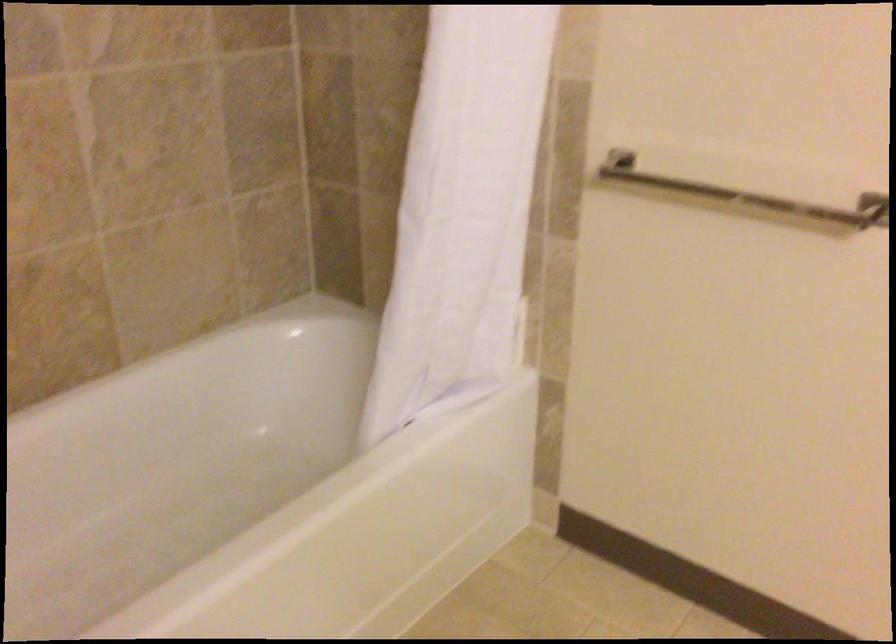
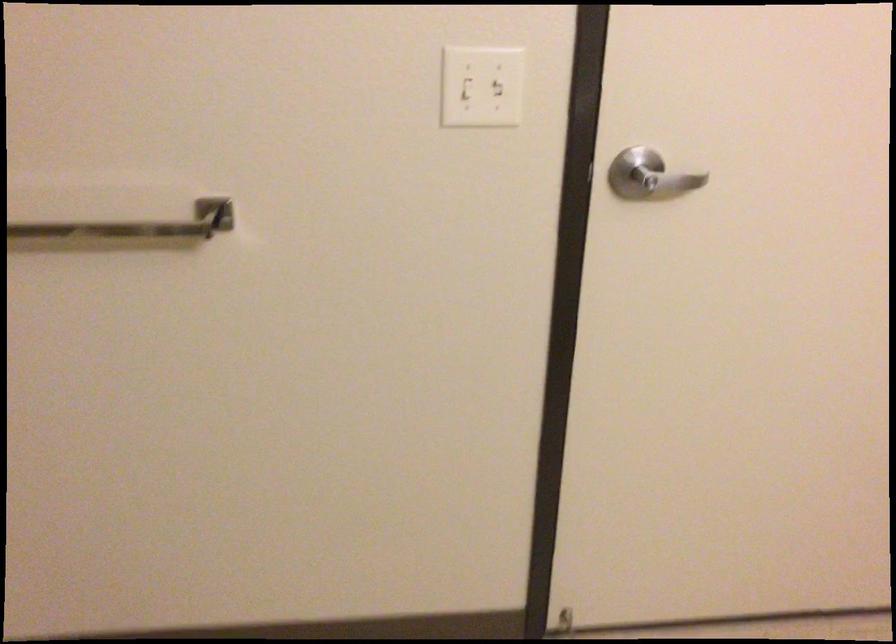
Find the pixel in the second image that matches (x=788, y=201) in the first image.

(125, 219)